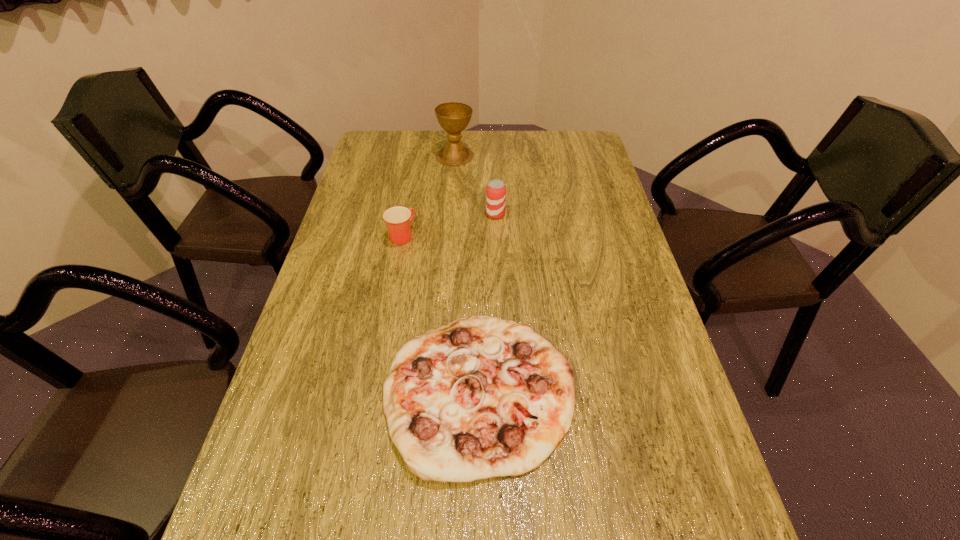
You are a GUI agent. You are given a task and a screenshot of the screen. Output one action in this format:
    pyautogui.click(x=<x>, y=<y>)
    Task: Click on the object that ranks as the third closest to the chalice
    
    Given the screenshot: What is the action you would take?
    pyautogui.click(x=481, y=397)

The image size is (960, 540). I want to click on free space that satisfies the following two spatial constraints: 1. on the front side of the second tallest object; 2. on the right side of the farthest object, so click(x=450, y=214).

This screenshot has width=960, height=540. Identify the location of free space that satisfies the following two spatial constraints: 1. on the back side of the beer can; 2. on the left side of the shortest object. (479, 214).

Identify the location of vacant area that satisfies the following two spatial constraints: 1. on the back side of the pizza; 2. on the right side of the third shortest object. (479, 214).